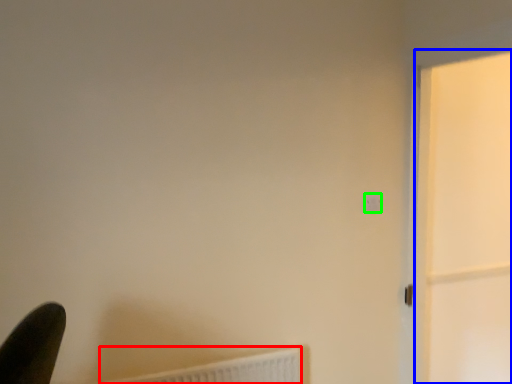
Question: Which object is the farthest from radiator (highlighted by a red box)? Choose among these: screen door (highlighted by a blue box) or light switch (highlighted by a green box).

Choices:
 (A) screen door
 (B) light switch

Answer: (A)